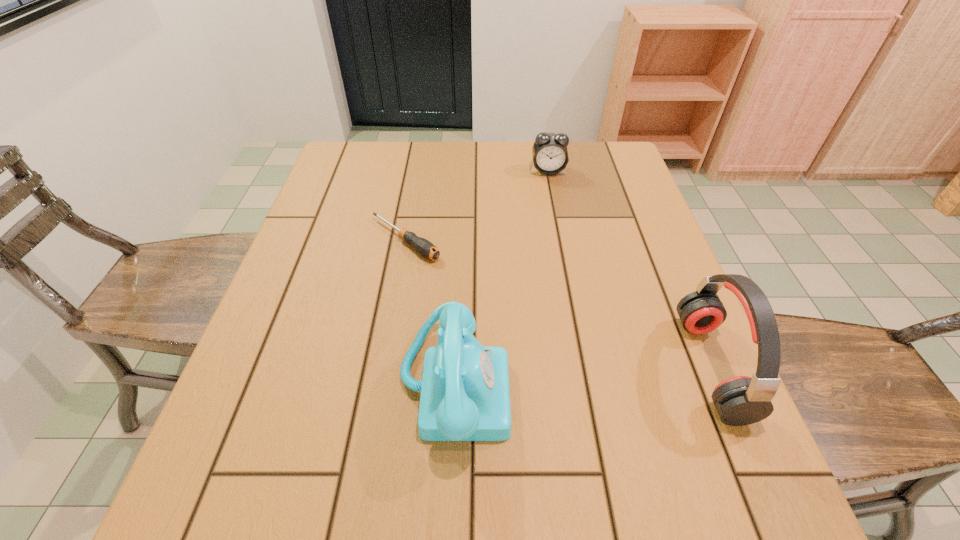
In order to click on the third shortest object in this screenshot , I will do [465, 396].

Locate an element on the screen. The image size is (960, 540). the rightmost object is located at coordinates (741, 400).

Where is `earphone`? The width and height of the screenshot is (960, 540). earphone is located at coordinates (741, 400).

The image size is (960, 540). Identify the location of the shortest object. (424, 247).

Locate an element on the screen. The height and width of the screenshot is (540, 960). screwdriver is located at coordinates (424, 247).

The image size is (960, 540). I want to click on alarm clock, so click(x=550, y=156).

The height and width of the screenshot is (540, 960). In order to click on the third tallest object in this screenshot , I will do 550,156.

This screenshot has height=540, width=960. I want to click on free location located 0.300m on the dial of the second tallest object, so click(672, 384).

At what (x,y) coordinates should I click in order to perform the action: click on vacant area located on the ear cups of the tallest object. Please return your answer as a coordinate pair (x, y). Image resolution: width=960 pixels, height=540 pixels. Looking at the image, I should click on (490, 367).

This screenshot has height=540, width=960. Identify the location of vacant space located on the ear cups of the tallest object. (605, 367).